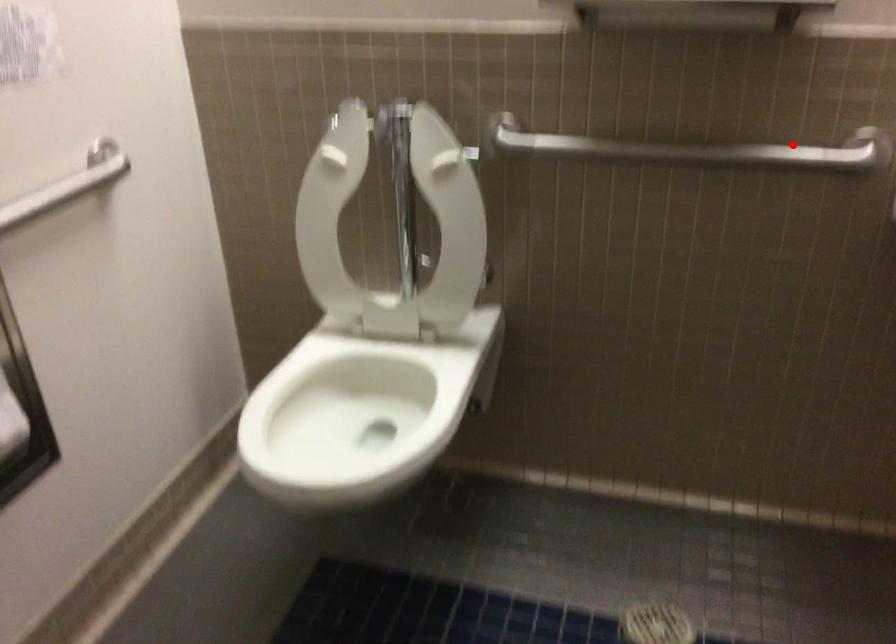
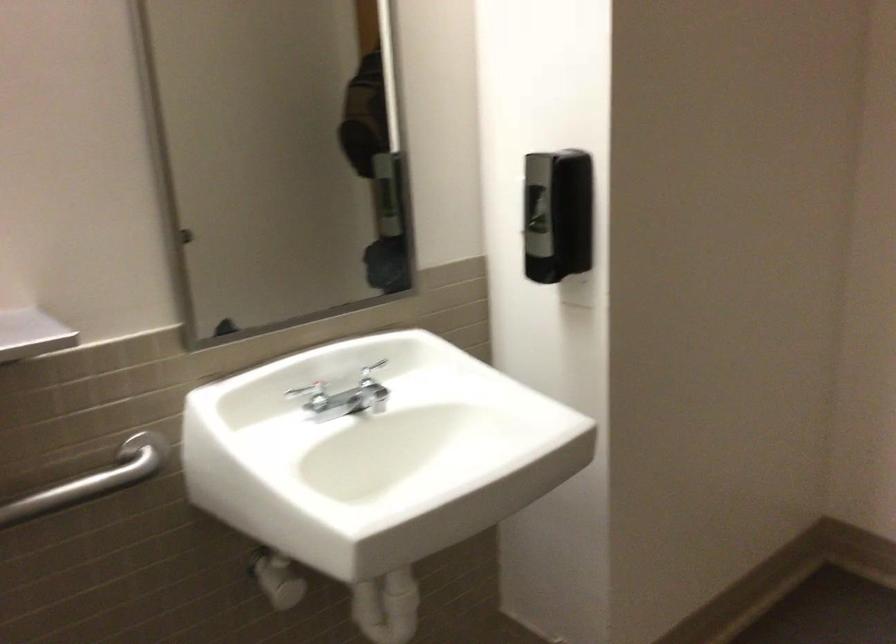
Question: I am providing you with two images of the same scene from different viewpoints. Image1 has a red point marked. In image2, the corresponding 3D location appears at what relative position? Reply with the corresponding letter.

Choices:
 (A) Closer
 (B) Farther

Answer: (A)